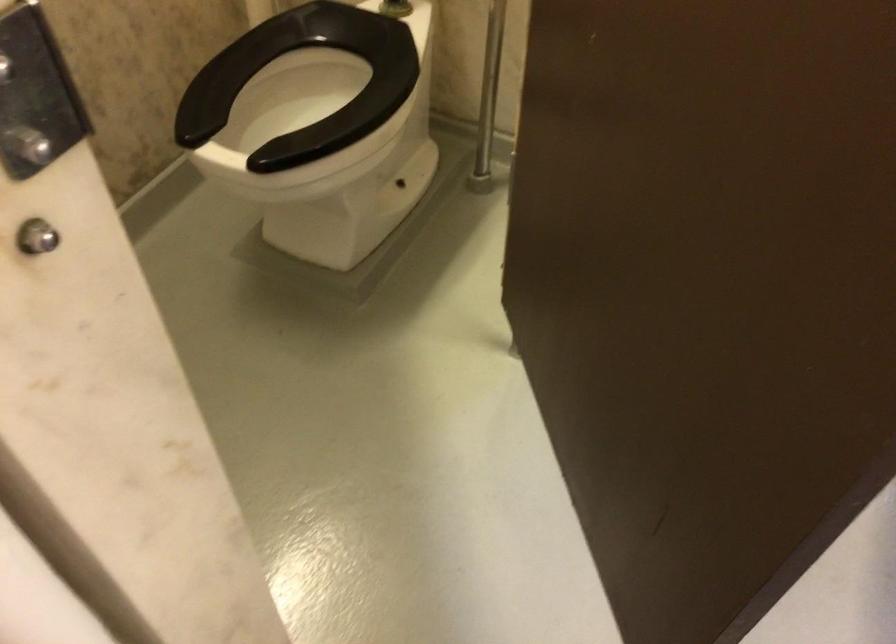
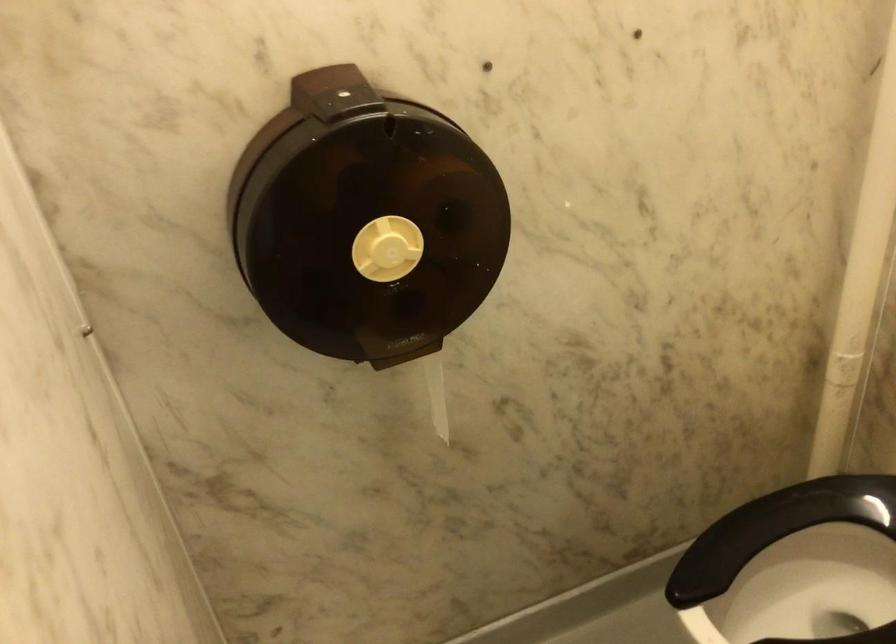
Question: Based on the continuous images, in which direction is the camera rotating? Reply with the corresponding letter.

Choices:
 (A) Left
 (B) Right
 (C) Up
 (D) Down

Answer: (A)